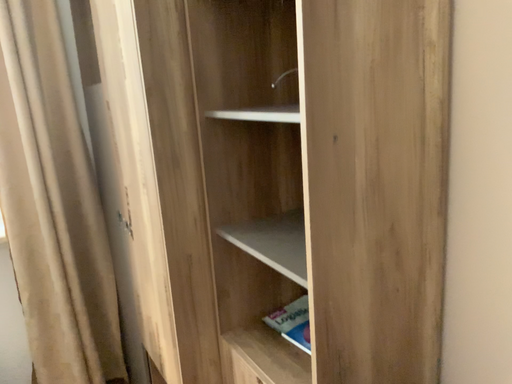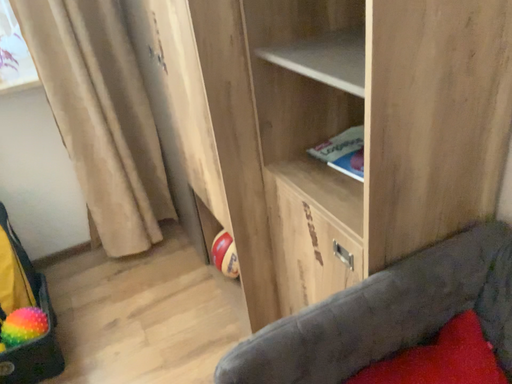
Question: How did the camera likely rotate when shooting the video?

Choices:
 (A) rotated downward
 (B) rotated upward

Answer: (A)